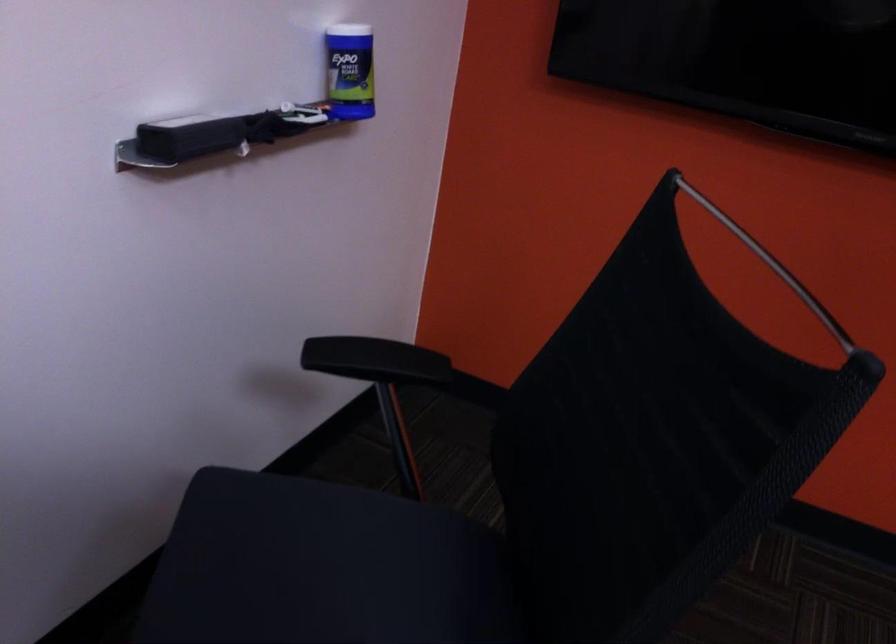
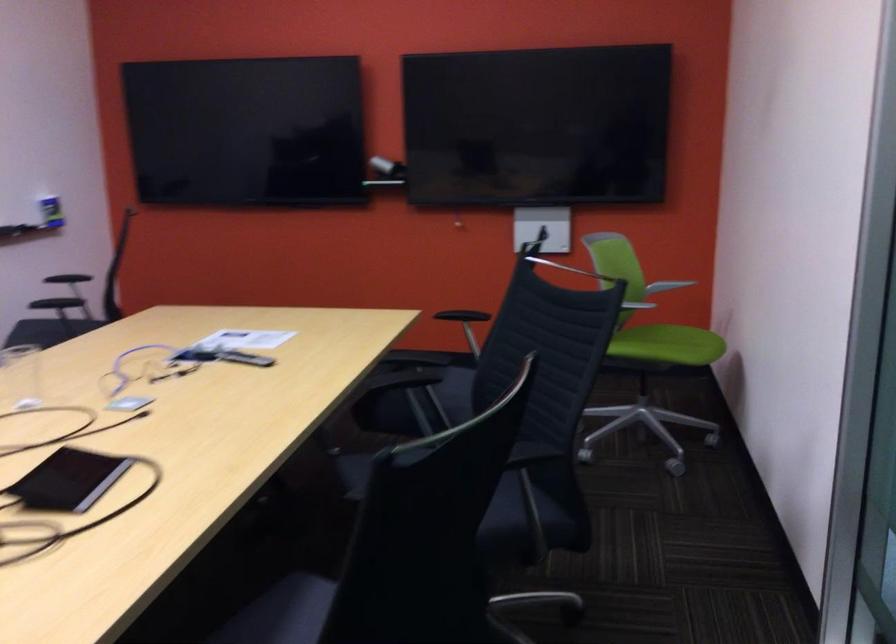
Question: Which direction would the cameraman need to move to produce the second image? Reply with the corresponding letter.

Choices:
 (A) Left
 (B) Right
 (C) Forward
 (D) Backward

Answer: (D)